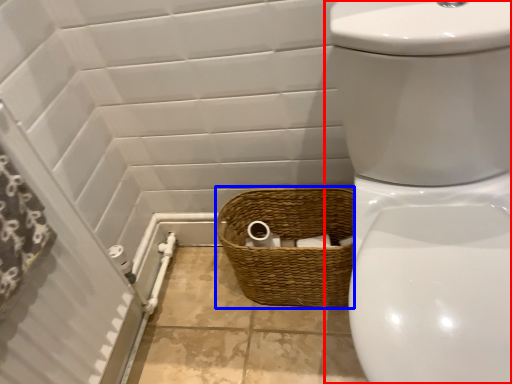
Question: Which object is closer to the camera taking this photo, toilet (highlighted by a red box) or basket (highlighted by a blue box)?

Choices:
 (A) toilet
 (B) basket

Answer: (A)